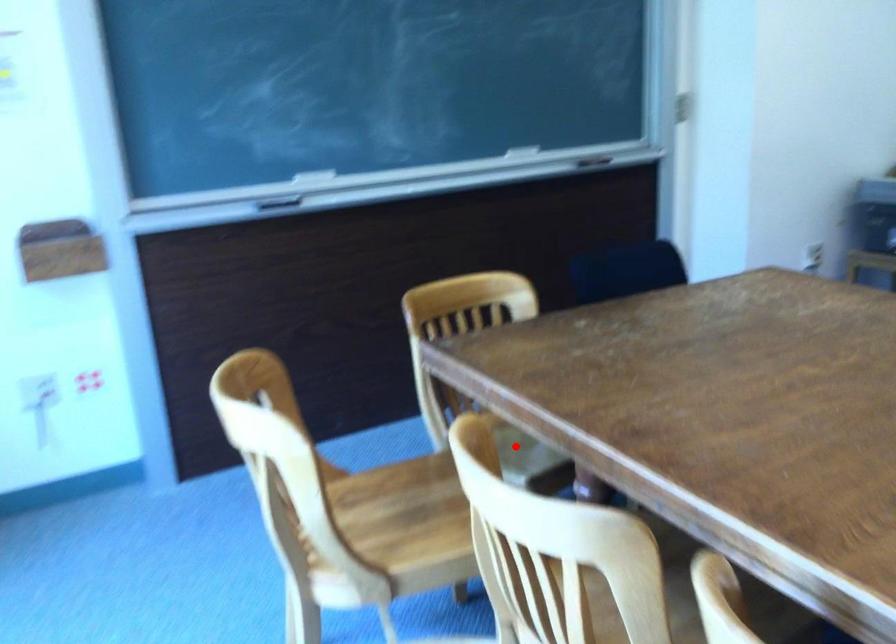
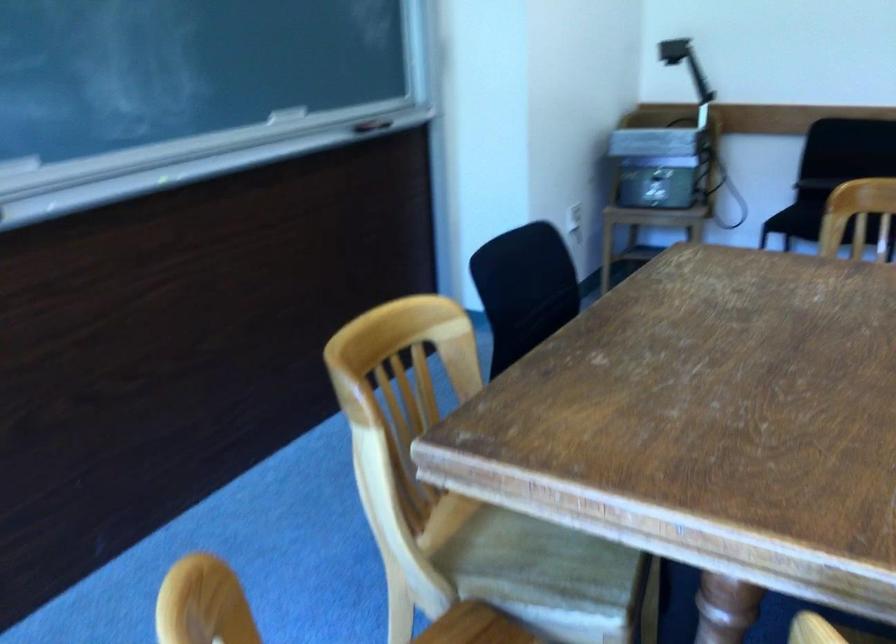
Question: I am providing you with two images of the same scene from different viewpoints. Given a red point in image1, look at the same physical point in image2. Is it:

Choices:
 (A) Closer to the viewpoint
 (B) Farther from the viewpoint

Answer: (A)